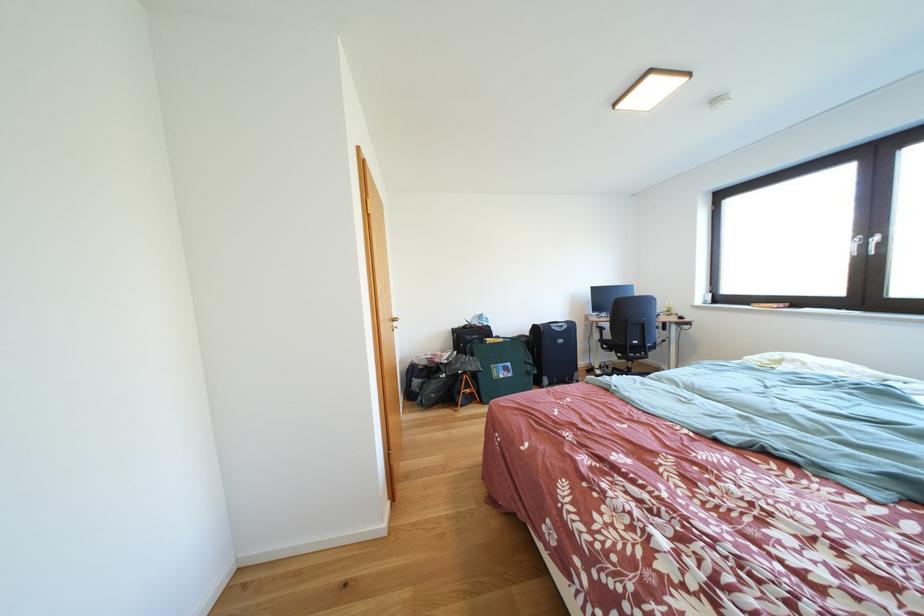
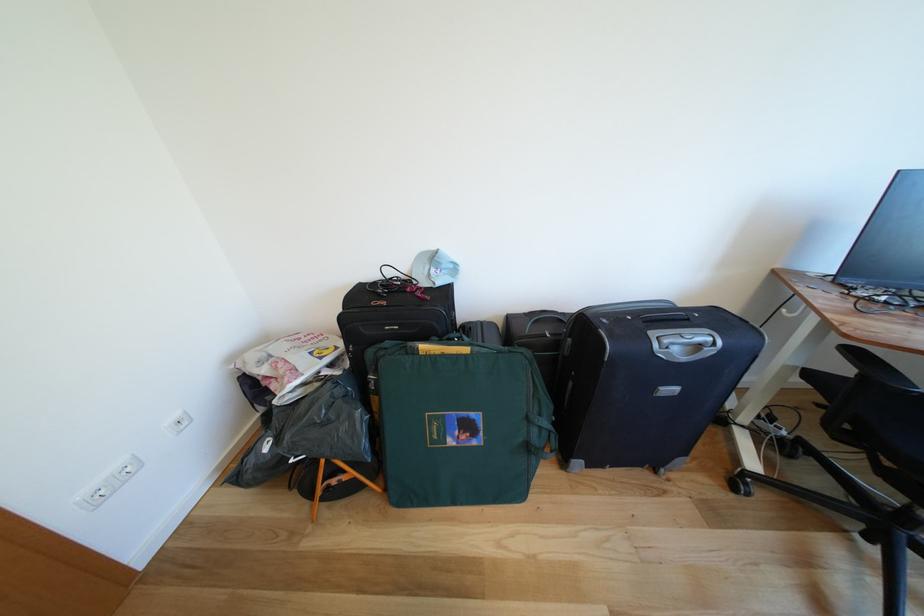
In the second image, find the point that corresponds to pixel 608 331 in the first image.

(862, 357)